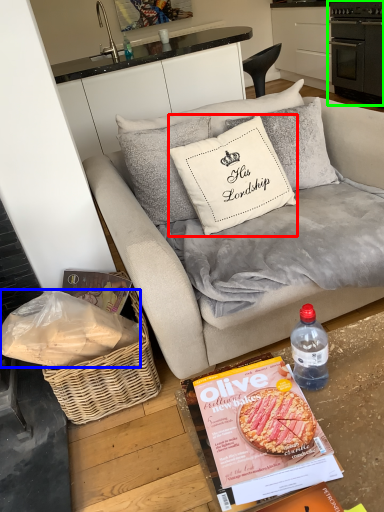
Question: Based on their relative distances, which object is farther from pillow (highlighted by a red box)? Choose from material (highlighted by a blue box) and appliance (highlighted by a green box).

Choices:
 (A) material
 (B) appliance

Answer: (B)